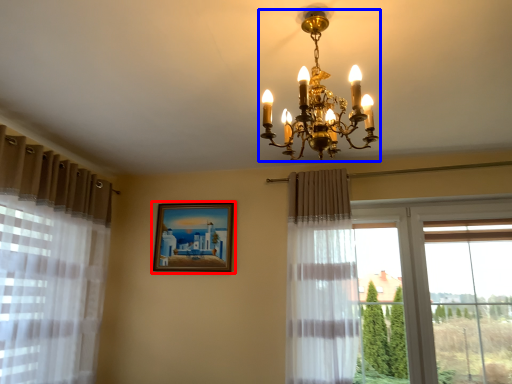
Question: Which point is closer to the camera, picture frame (highlighted by a red box) or lamp (highlighted by a blue box)?

Choices:
 (A) picture frame
 (B) lamp

Answer: (B)